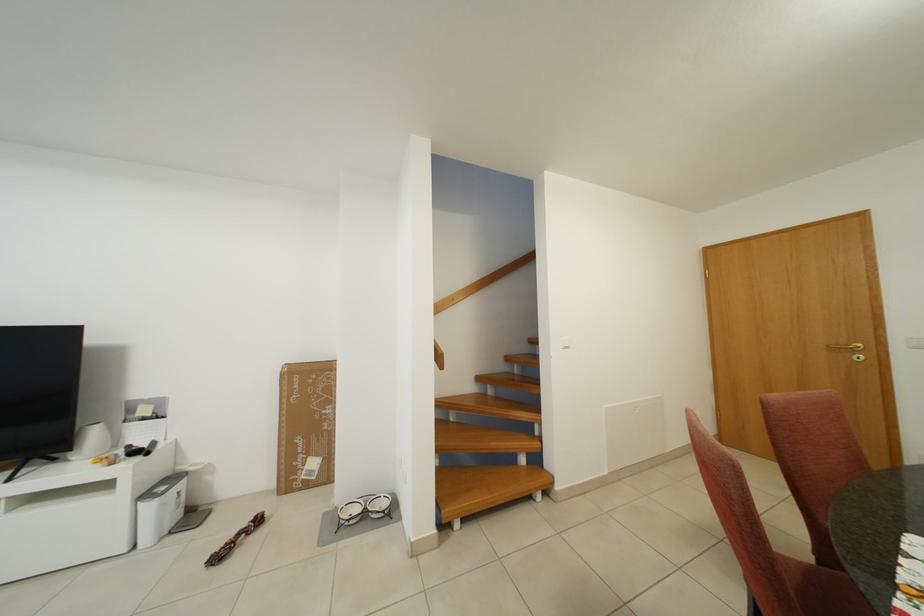
This screenshot has width=924, height=616. In order to click on wooden stair handrail in this screenshot , I will do `click(482, 283)`.